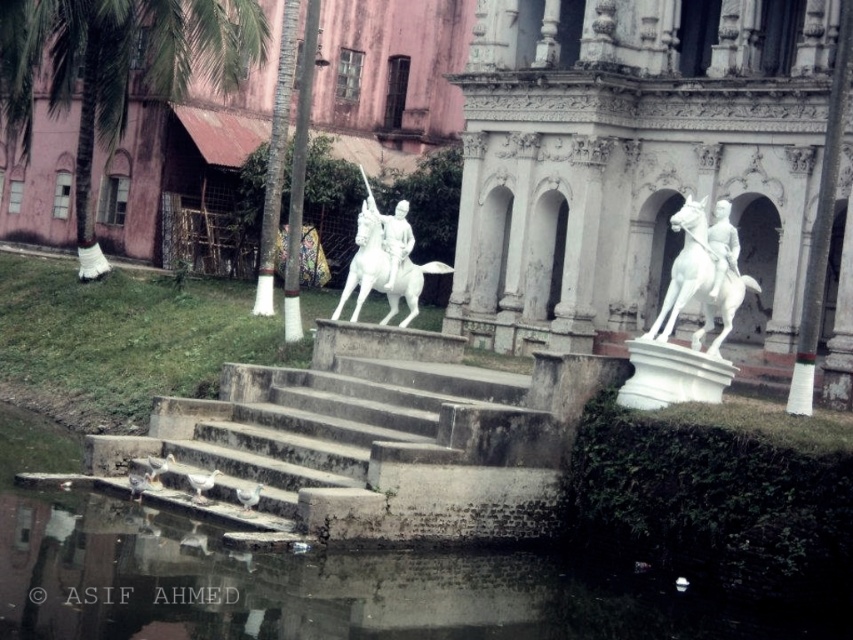
Question: Can you confirm if concrete stairs at lower center is smaller than white marble horse at center?

Choices:
 (A) no
 (B) yes

Answer: (A)

Question: Where is white marble statue at center located in relation to green leafy palm tree at upper left in the image?

Choices:
 (A) below
 (B) above

Answer: (A)

Question: Which point is farther to the camera?

Choices:
 (A) white glossy horse at center
 (B) white marble statue at center
 (C) concrete stairs at lower center
 (D) green leafy palm tree at upper left

Answer: (D)

Question: Estimate the real-world distances between objects in this image. Which object is farther from the concrete stairs at lower center?

Choices:
 (A) white marble statue at center
 (B) white marble statue at right
 (C) green leafy palm tree at upper left
 (D) white glossy horse at center

Answer: (C)

Question: Considering the real-world distances, which object is closest to the white glossy statue at center?

Choices:
 (A) white marble statue at right
 (B) white marble horse at center
 (C) white marble statue at center

Answer: (B)

Question: Can you confirm if white marble statue at center is positioned above white marble statue at right?

Choices:
 (A) yes
 (B) no

Answer: (A)